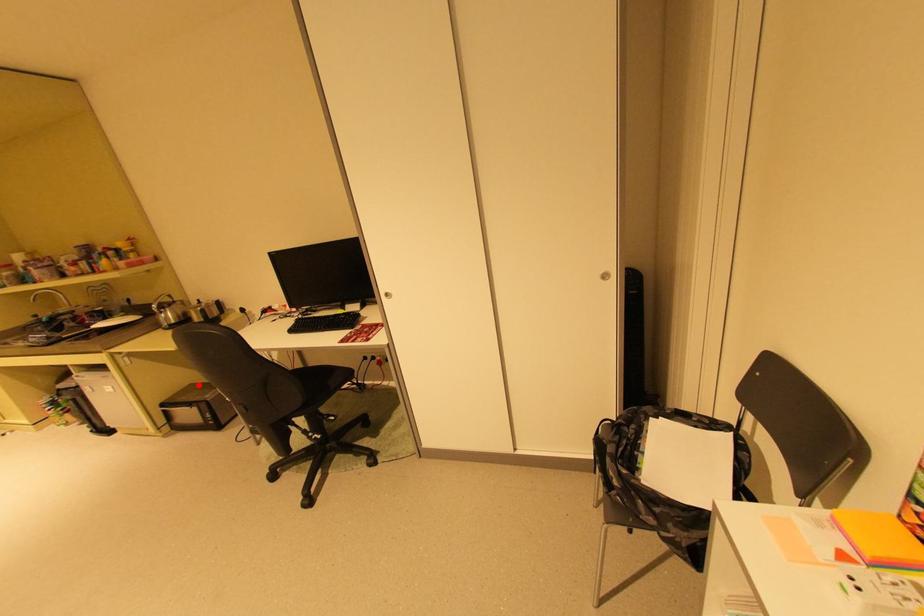
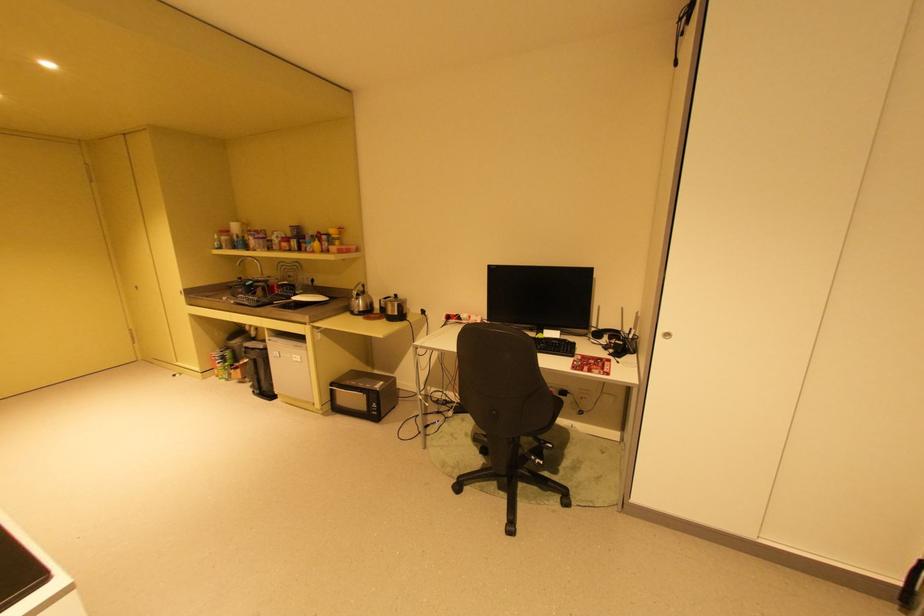
Locate, in the second image, the point that corresponds to the highlighted location in the first image.

(359, 371)